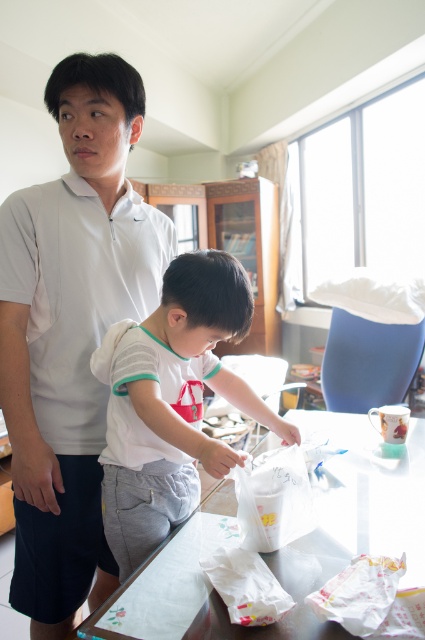
Question: Can you confirm if white cotton shirt at center is smaller than transparent plastic table at center?

Choices:
 (A) yes
 (B) no

Answer: (A)

Question: Which point appears farthest from the camera in this image?

Choices:
 (A) (102, 202)
 (B) (291, 618)
 (C) (243, 298)

Answer: (A)

Question: Which of the following is the closest to the observer?

Choices:
 (A) white matte shirt at upper left
 (B) transparent plastic table at center
 (C) white cotton shirt at center

Answer: (B)

Question: Is white cotton shirt at center further to camera compared to transparent plastic table at center?

Choices:
 (A) yes
 (B) no

Answer: (A)

Question: Which object is the closest to the transparent plastic table at center?

Choices:
 (A) white cotton shirt at center
 (B) white matte shirt at upper left

Answer: (A)

Question: Is white cotton shirt at center below transparent plastic table at center?

Choices:
 (A) no
 (B) yes

Answer: (A)